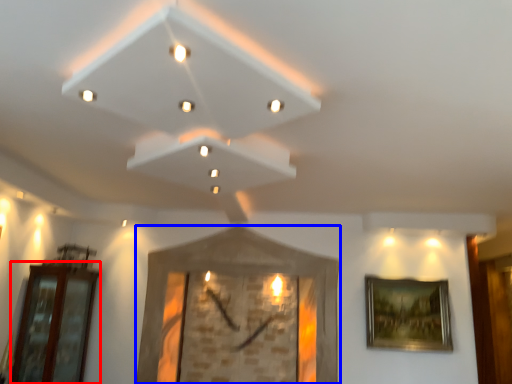
Question: Which object appears farthest to the camera in this image, glass door (highlighted by a red box) or picture frame (highlighted by a blue box)?

Choices:
 (A) glass door
 (B) picture frame

Answer: (B)